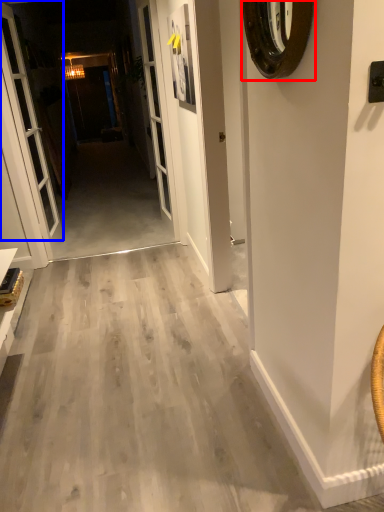
Question: Which point is further to the camera, clock (highlighted by a red box) or door (highlighted by a blue box)?

Choices:
 (A) clock
 (B) door

Answer: (B)